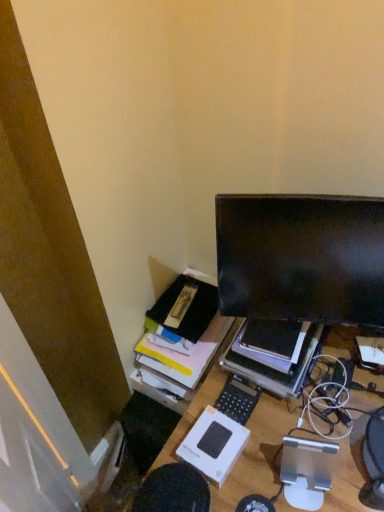
What do you see at coordinates (301, 258) in the screenshot?
I see `matte black monitor at upper right` at bounding box center [301, 258].

You are a GUI agent. You are given a task and a screenshot of the screen. Output one action in this format:
    pyautogui.click(x=<x>, y=<y>)
    Task: Click on the black plastic calculator at center
    Image resolution: width=384 pixels, height=512 pixels.
    Given the screenshot: What is the action you would take?
    pyautogui.click(x=238, y=399)

At what (x,y) coordinates should I click in order to perform the action: click on black matte monitor at upper right. Please return your answer as a coordinate pair (x, y). Looking at the image, I should click on (273, 367).

Can you see matte black monitor at upper right touching wooden desk at center?

They are not placed beside each other.

Does matte black monitor at upper right have a larger size compared to wooden desk at center?

Actually, matte black monitor at upper right might be smaller than wooden desk at center.

Between matte black monitor at upper right and wooden desk at center, which one has more height?

Standing taller between the two is wooden desk at center.

From a real-world perspective, who is located higher, matte black monitor at upper right or wooden desk at center?

matte black monitor at upper right is physically above.

Can you confirm if wooden desk at center is positioned to the right of matte black monitor at upper right?

Yes, wooden desk at center is to the right of matte black monitor at upper right.

Is wooden desk at center situated inside matte black monitor at upper right or outside?

wooden desk at center is not enclosed by matte black monitor at upper right.

Which object is wider, wooden desk at center or matte black monitor at upper right?

With larger width is wooden desk at center.

Identify the location of desk below the matte black monitor at upper right (from a real-world perspective). (257, 454).

Considering the sizes of objects black matte monitor at upper right and wooden desk at center in the image provided, who is wider, black matte monitor at upper right or wooden desk at center?

With larger width is wooden desk at center.

Is black matte monitor at upper right facing towards wooden desk at center?

No, black matte monitor at upper right is not turned towards wooden desk at center.

Which of these two, black matte monitor at upper right or wooden desk at center, stands taller?

wooden desk at center is taller.

Between point (250, 362) and point (359, 441), which one is positioned behind?

Point (250, 362)

Where is `desk to the right of black plastic calculator at center`? Image resolution: width=384 pixels, height=512 pixels. desk to the right of black plastic calculator at center is located at coordinates [x=257, y=454].

From the image's perspective, is black plastic calculator at center on top of wooden desk at center?

Indeed, from the image's perspective, black plastic calculator at center is shown above wooden desk at center.

Is black plastic calculator at center turned away from wooden desk at center?

No, black plastic calculator at center is not facing away from wooden desk at center.

Considering the sizes of objects black plastic calculator at center and wooden desk at center in the image provided, who is taller, black plastic calculator at center or wooden desk at center?

Standing taller between the two is wooden desk at center.

Is matte black monitor at upper right located outside black matte monitor at upper right?

Yes.

Between matte black monitor at upper right and black matte monitor at upper right, which one has larger size?

Bigger between the two is black matte monitor at upper right.

Does matte black monitor at upper right have a lesser height compared to black matte monitor at upper right?

In fact, matte black monitor at upper right may be taller than black matte monitor at upper right.

Would you say matte black monitor at upper right is a long distance from black matte monitor at upper right?

No, matte black monitor at upper right is in close proximity to black matte monitor at upper right.

Is wooden desk at center turned away from black matte monitor at upper right?

wooden desk at center is not turned away from black matte monitor at upper right.

From the image's perspective, which is above, wooden desk at center or black matte monitor at upper right?

black matte monitor at upper right.

Is wooden desk at center in contact with black matte monitor at upper right?

wooden desk at center and black matte monitor at upper right are clearly separated.

Does black plastic calculator at center have a greater height compared to matte black monitor at upper right?

No.

Locate an element on the screen. Image resolution: width=384 pixels, height=512 pixels. computer monitor that is above the black plastic calculator at center (from a real-world perspective) is located at coordinates (301, 258).

Looking at this image, considering the sizes of objects black plastic calculator at center and matte black monitor at upper right in the image provided, who is thinner, black plastic calculator at center or matte black monitor at upper right?

matte black monitor at upper right.

This screenshot has height=512, width=384. In order to click on desk beneath the matte black monitor at upper right (from a real-world perspective) in this screenshot , I will do `click(257, 454)`.

At what (x,y) coordinates should I click in order to perform the action: click on desk on the right of matte black monitor at upper right. Please return your answer as a coordinate pair (x, y). Looking at the image, I should click on (257, 454).

Considering their positions, is matte black monitor at upper right positioned further to wooden desk at center than black matte monitor at upper right?

Among the two, matte black monitor at upper right is located further to wooden desk at center.

From the image, which object appears to be farther from black matte monitor at upper right, matte black monitor at upper right or black plastic calculator at center?

matte black monitor at upper right is further to black matte monitor at upper right.

Based on their spatial positions, is black plastic calculator at center or black matte monitor at upper right closer to matte black monitor at upper right?

The object closer to matte black monitor at upper right is black matte monitor at upper right.

Looking at the image, which one is located further to matte black monitor at upper right, wooden desk at center or black plastic calculator at center?

Based on the image, black plastic calculator at center appears to be further to matte black monitor at upper right.

Looking at the image, which one is located further to black matte monitor at upper right, black plastic calculator at center or matte black monitor at upper right?

Among the two, matte black monitor at upper right is located further to black matte monitor at upper right.

Which object lies nearer to the anchor point black matte monitor at upper right, wooden desk at center or black plastic calculator at center?

Among the two, black plastic calculator at center is located nearer to black matte monitor at upper right.

Which object lies further to the anchor point matte black monitor at upper right, wooden desk at center or black matte monitor at upper right?

Among the two, wooden desk at center is located further to matte black monitor at upper right.

Which object lies nearer to the anchor point black plastic calculator at center, black matte monitor at upper right or matte black monitor at upper right?

black matte monitor at upper right lies closer to black plastic calculator at center than the other object.

The image size is (384, 512). I want to click on computer keyboard that lies between black matte monitor at upper right and wooden desk at center from top to bottom, so click(x=238, y=399).

The image size is (384, 512). What are the coordinates of `computer keyboard between matte black monitor at upper right and wooden desk at center from top to bottom` in the screenshot? It's located at (238, 399).

Locate an element on the screen. Image resolution: width=384 pixels, height=512 pixels. computer between matte black monitor at upper right and black plastic calculator at center vertically is located at coordinates (273, 367).

I want to click on computer between matte black monitor at upper right and wooden desk at center in the vertical direction, so click(x=273, y=367).